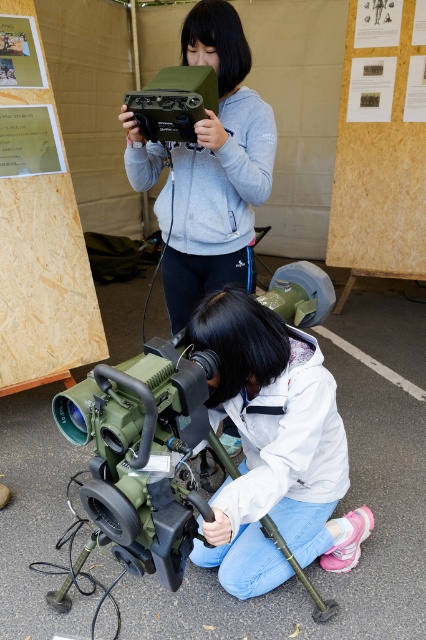
You are a photographer at the event and want to capture a photo that includes both the white matte jacket at lower center and the wooden board at upper left. Based on their positions, which object should be placed on the right side of your photo frame?

The white matte jacket at lower center should be placed on the right side of the photo frame because it is positioned on the right side of the wooden board at upper left.

You are a photographer at the exhibition and need to take a photo of the matte green plastic video camera at upper center without including the wooden board at upper left in the frame. Is this possible given their positions?

The wooden board at upper left is further to the viewer than the matte green plastic video camera at upper center, so adjusting the camera angle to focus on the matte green plastic video camera at upper center while moving the camera position backward might exclude the wooden board at upper left from the frame.